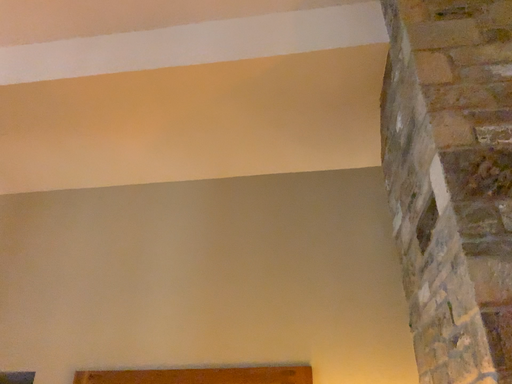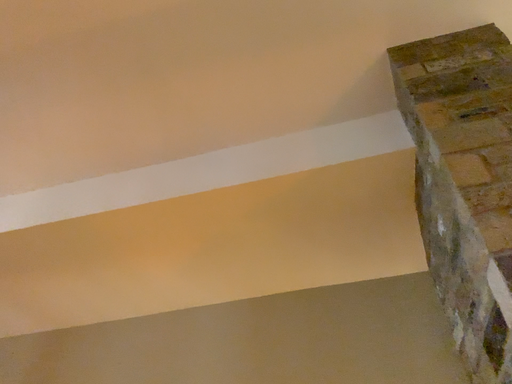
Question: How did the camera likely rotate when shooting the video?

Choices:
 (A) rotated downward
 (B) rotated upward

Answer: (B)